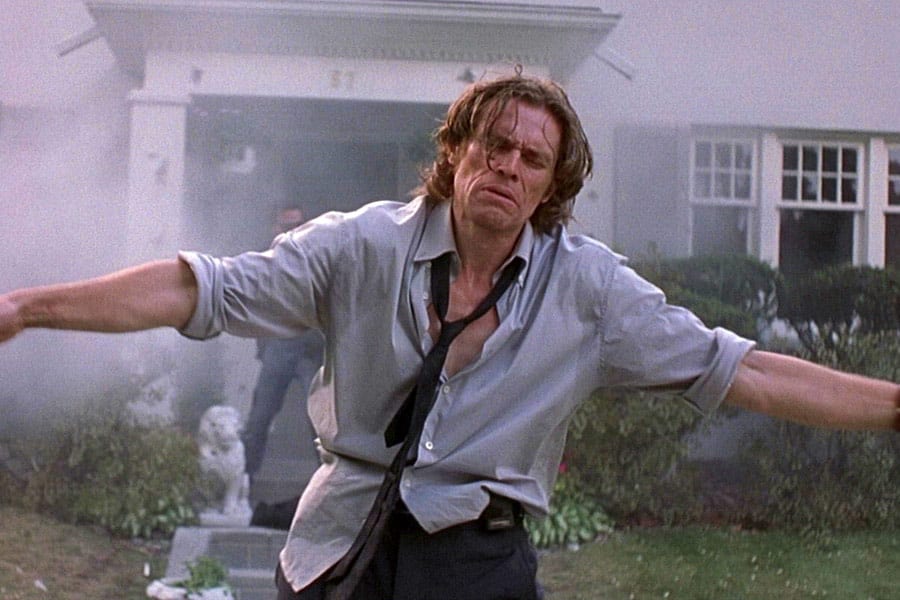
Identify the location of flower pot. The image size is (900, 600). (165, 590).